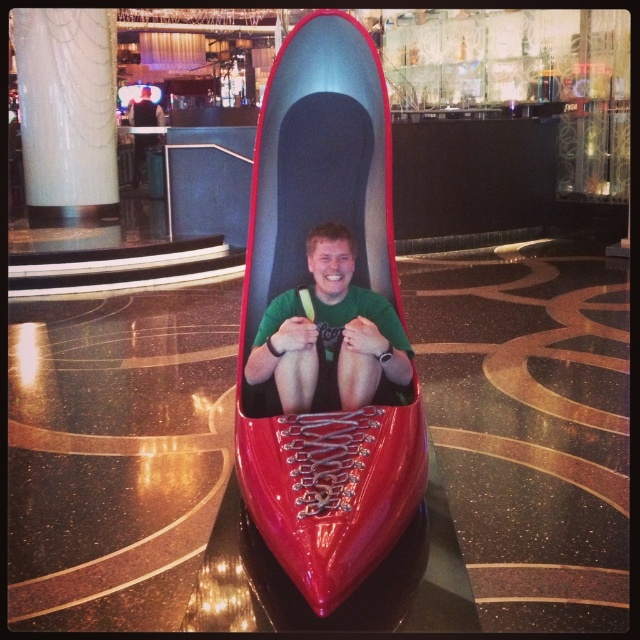
Question: Which of these objects is positioned closest to the green fabric shirt at center?

Choices:
 (A) green matte shirt at center
 (B) glossy plastic shoe at center

Answer: (B)

Question: Which object is closer to the camera taking this photo?

Choices:
 (A) green matte shirt at center
 (B) glossy plastic shoe at center

Answer: (B)

Question: In this image, where is glossy plastic shoe at center located relative to green matte shirt at center?

Choices:
 (A) left
 (B) right

Answer: (A)

Question: Where is glossy plastic shoe at center located in relation to green fabric shirt at center in the image?

Choices:
 (A) right
 (B) left

Answer: (A)

Question: Estimate the real-world distances between objects in this image. Which object is closer to the green matte shirt at center?

Choices:
 (A) glossy plastic shoe at center
 (B) green fabric shirt at center

Answer: (A)

Question: Can you confirm if glossy plastic shoe at center is thinner than green fabric shirt at center?

Choices:
 (A) no
 (B) yes

Answer: (A)